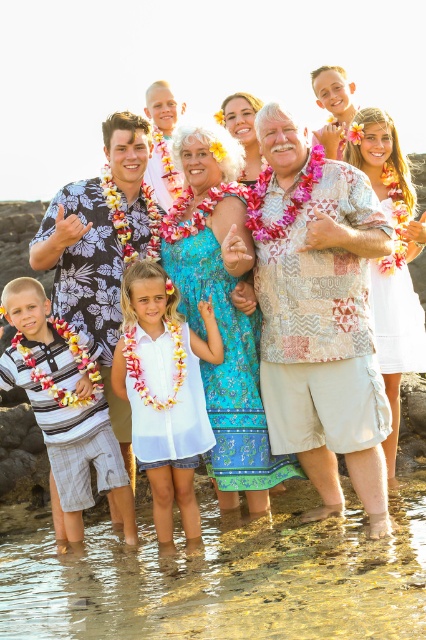
You are a photographer trying to capture a wide shot of the entire group while ensuring the clear water at lower center and the striped cotton shirt at lower left are both in focus. Given that your camera has a depth of field that can cover up to 3 meters, will you be able to achieve this?

The distance between the clear water at lower center and the striped cotton shirt at lower left is 3.06 meters. Since the camera can only cover up to 3 meters, the depth of field will not be sufficient to keep both objects in focus simultaneously.

You are a photographer trying to capture the sunset scene. You notice the clear water at lower center and the striped cotton shirt at lower left in your viewfinder. Which object occupies a bigger area in the photo?

The clear water at lower center is larger in size than the striped cotton shirt at lower left, so it occupies a bigger area in the photo.

You are a tailor who needs to determine which shirt requires more fabric to make between the white cotton shirt at center and the striped cotton shirt at lower left. Based on the image, which one would you choose?

The striped cotton shirt at lower left requires more fabric because its width is greater than the white cotton shirt at center.